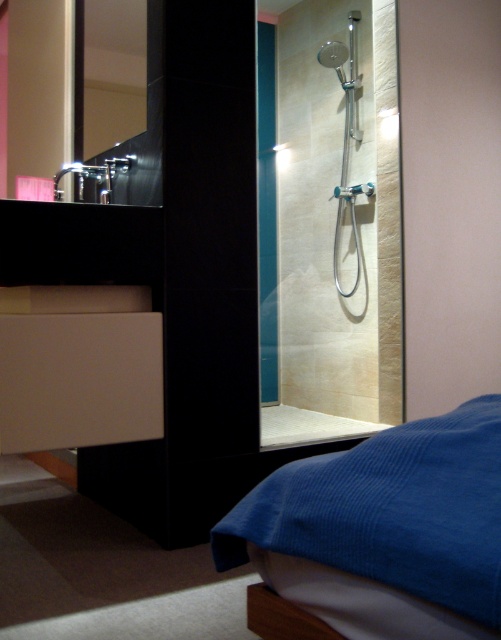
Who is shorter, blue corduroy bed at lower right or polished chrome faucet at upper left?

Standing shorter between the two is blue corduroy bed at lower right.

This screenshot has width=501, height=640. What do you see at coordinates (384, 531) in the screenshot? I see `blue corduroy bed at lower right` at bounding box center [384, 531].

What do you see at coordinates (384, 531) in the screenshot?
I see `blue corduroy bed at lower right` at bounding box center [384, 531].

Where is `blue corduroy bed at lower right`? The height and width of the screenshot is (640, 501). blue corduroy bed at lower right is located at coordinates (384, 531).

Is white matte drawer at lower left shorter than polished silver mirror at upper left?

Correct, white matte drawer at lower left is not as tall as polished silver mirror at upper left.

Describe the element at coordinates (79, 380) in the screenshot. This screenshot has height=640, width=501. I see `white matte drawer at lower left` at that location.

Locate an element on the screen. white matte drawer at lower left is located at coordinates (79, 380).

Does blue corduroy bed at lower right appear under matte silver showerhead at upper center?

Indeed, blue corduroy bed at lower right is positioned under matte silver showerhead at upper center.

The image size is (501, 640). In order to click on blue corduroy bed at lower right in this screenshot , I will do `click(384, 531)`.

At what (x,y) coordinates should I click in order to perform the action: click on blue corduroy bed at lower right. Please return your answer as a coordinate pair (x, y). Image resolution: width=501 pixels, height=640 pixels. Looking at the image, I should click on (384, 531).